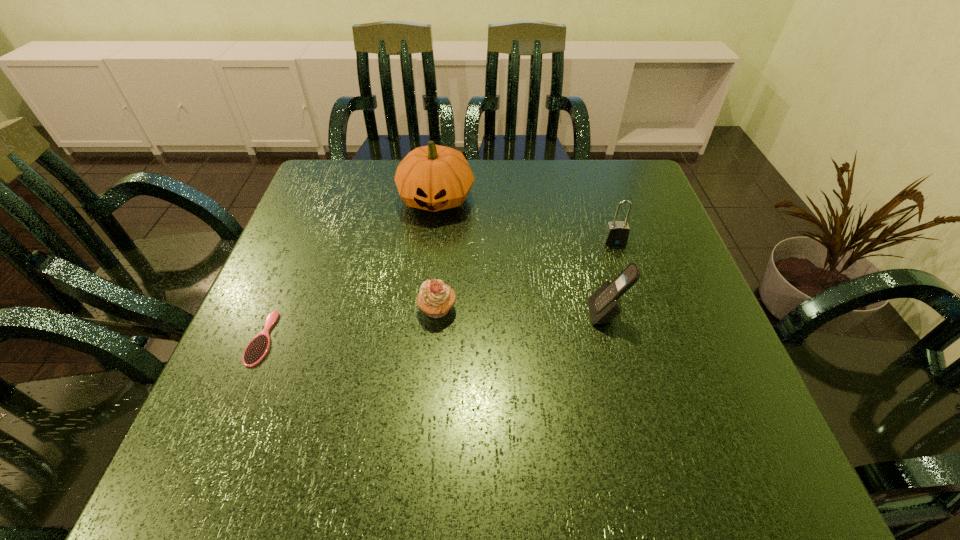
The image size is (960, 540). I want to click on free spot between the rightmost object and the cellular telephone, so tap(611, 277).

Where is `unoccupied area between the farthest object and the fourth object from left to right`? The image size is (960, 540). unoccupied area between the farthest object and the fourth object from left to right is located at coordinates click(x=521, y=256).

Where is `blank region between the hairbrush and the tallest object`? blank region between the hairbrush and the tallest object is located at coordinates (349, 268).

At what (x,y) coordinates should I click in order to perform the action: click on free spot between the cupcake and the second object from right to left. Please return your answer as a coordinate pair (x, y). The width and height of the screenshot is (960, 540). Looking at the image, I should click on (522, 312).

Select which object appears as the second closest to the shortest object. Please provide its 2D coordinates. Your answer should be formatted as a tuple, i.e. [(x, y)], where the tuple contains the x and y coordinates of a point satisfying the conditions above.

[(434, 178)]

Where is `the second closest object to the second object from right to left`? The height and width of the screenshot is (540, 960). the second closest object to the second object from right to left is located at coordinates (435, 298).

Where is `blank area in the image that satisfies the following two spatial constraints: 1. on the side of the fourth tallest object with the carved face; 2. on the right side of the gourd`? blank area in the image that satisfies the following two spatial constraints: 1. on the side of the fourth tallest object with the carved face; 2. on the right side of the gourd is located at coordinates (423, 309).

Locate an element on the screen. This screenshot has width=960, height=540. vacant space that satisfies the following two spatial constraints: 1. on the side of the fourth tallest object with the carved face; 2. on the right side of the gourd is located at coordinates (423, 309).

Image resolution: width=960 pixels, height=540 pixels. I want to click on free space that satisfies the following two spatial constraints: 1. on the front-facing side of the fourth object from left to right; 2. on the front side of the shortest object, so click(612, 338).

The image size is (960, 540). Find the location of `vacant space that satisfies the following two spatial constraints: 1. on the shackle of the rightmost object; 2. on the front-facing side of the second object from right to left`. vacant space that satisfies the following two spatial constraints: 1. on the shackle of the rightmost object; 2. on the front-facing side of the second object from right to left is located at coordinates (638, 314).